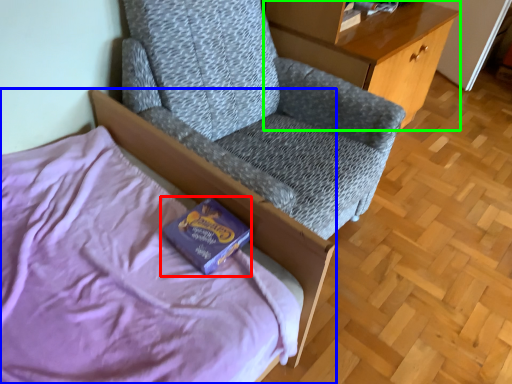
Question: Which object is the farthest from paperback book (highlighted by a red box)? Choose among these: bed (highlighted by a blue box) or desk (highlighted by a green box).

Choices:
 (A) bed
 (B) desk

Answer: (B)